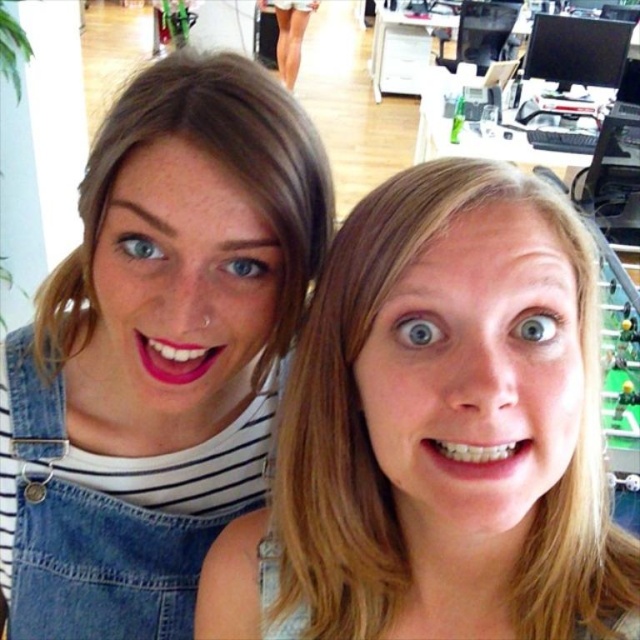
You are an office worker who wants to choose between the matte denim overalls at center and the matte denim overalls at left to wear for a meeting. Which pair has a larger size?

The matte denim overalls at center is larger in size than the matte denim overalls at left, so the matte denim overalls at center is the larger size option.